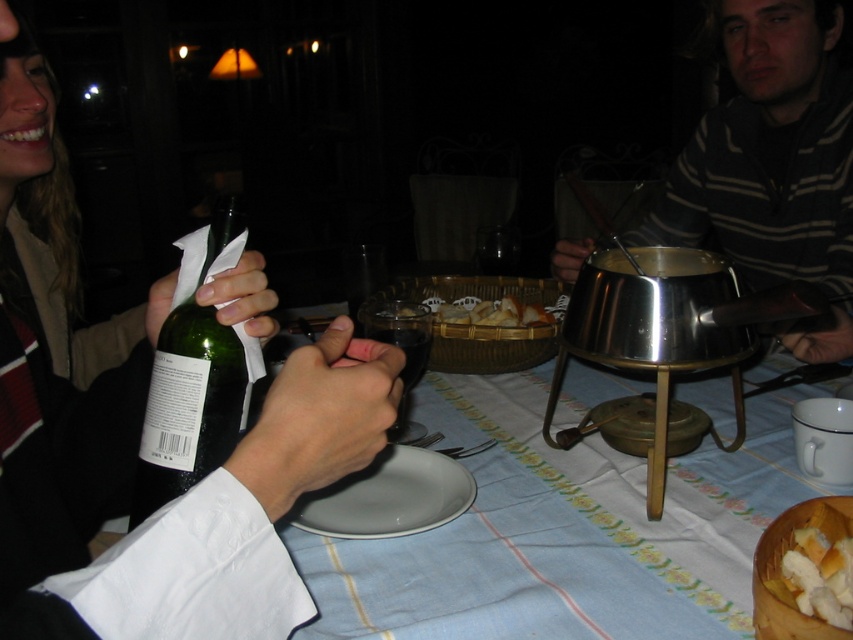
Is white glossy plate at center positioned at the back of golden brown bread at center?

That is False.

Is white glossy plate at center above golden brown bread at center?

Incorrect, white glossy plate at center is not positioned above golden brown bread at center.

Who is more distant from viewer, (x=392, y=492) or (x=502, y=307)?

Point (x=502, y=307)

Find the location of a particular element. Image resolution: width=853 pixels, height=640 pixels. white glossy plate at center is located at coordinates (387, 497).

Looking at this image, which is more to the left, matte green bottle at lower left or striped sweater at right?

matte green bottle at lower left is more to the left.

Consider the image. Who is positioned more to the right, matte green bottle at lower left or striped sweater at right?

striped sweater at right is more to the right.

Measure the distance between matte green bottle at lower left and camera.

matte green bottle at lower left is 11.93 inches from camera.

At what (x,y) coordinates should I click in order to perform the action: click on matte green bottle at lower left. Please return your answer as a coordinate pair (x, y). This screenshot has height=640, width=853. Looking at the image, I should click on (138, 433).

The width and height of the screenshot is (853, 640). What do you see at coordinates (189, 404) in the screenshot?
I see `green glass bottle at left` at bounding box center [189, 404].

Based on the photo, which is more to the right, green glass bottle at left or transparent glass at center?

Positioned to the right is transparent glass at center.

The image size is (853, 640). What do you see at coordinates (189, 404) in the screenshot? I see `green glass bottle at left` at bounding box center [189, 404].

Locate an element on the screen. Image resolution: width=853 pixels, height=640 pixels. green glass bottle at left is located at coordinates (189, 404).